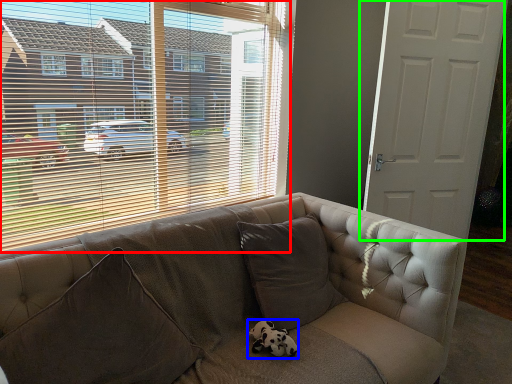
Question: Which object is the closest to the window (highlighted by a red box)? Choose among these: animal (highlighted by a blue box) or door (highlighted by a green box).

Choices:
 (A) animal
 (B) door

Answer: (B)